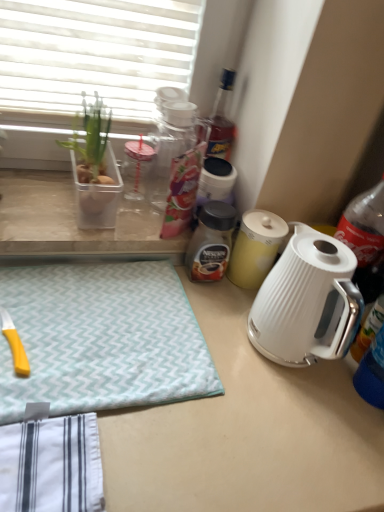
Question: Would you consider clear plastic container at left to be distant from yellow matte canister at center?

Choices:
 (A) yes
 (B) no

Answer: (B)

Question: From a real-world perspective, is clear plastic container at left positioned over yellow matte canister at center based on gravity?

Choices:
 (A) yes
 (B) no

Answer: (B)

Question: Is clear plastic container at left outside of yellow matte canister at center?

Choices:
 (A) no
 (B) yes

Answer: (B)

Question: Is clear plastic container at left bigger than yellow matte canister at center?

Choices:
 (A) yes
 (B) no

Answer: (A)

Question: Is clear plastic container at left smaller than yellow matte canister at center?

Choices:
 (A) no
 (B) yes

Answer: (A)

Question: Considering the positions of white glossy electric kettle at center-right and clear plastic container at left in the image, is white glossy electric kettle at center-right taller or shorter than clear plastic container at left?

Choices:
 (A) tall
 (B) short

Answer: (A)

Question: Is white glossy electric kettle at center-right in front of or behind clear plastic container at left in the image?

Choices:
 (A) behind
 (B) front

Answer: (B)

Question: From a real-world perspective, relative to clear plastic container at left, is white glossy electric kettle at center-right vertically above or below?

Choices:
 (A) above
 (B) below

Answer: (A)

Question: From the image's perspective, is white glossy electric kettle at center-right located above or below clear plastic container at left?

Choices:
 (A) above
 (B) below

Answer: (B)

Question: Looking at their shapes, would you say clear plastic container at left is wider or thinner than white glossy electric kettle at center?

Choices:
 (A) wide
 (B) thin

Answer: (B)

Question: From a real-world perspective, is clear plastic container at left positioned above or below white glossy electric kettle at center?

Choices:
 (A) above
 (B) below

Answer: (A)

Question: Considering the positions of point pyautogui.click(x=125, y=243) and point pyautogui.click(x=266, y=496), is point pyautogui.click(x=125, y=243) closer or farther from the camera than point pyautogui.click(x=266, y=496)?

Choices:
 (A) farther
 (B) closer

Answer: (A)

Question: From the image's perspective, is clear plastic container at left positioned above or below white glossy electric kettle at center?

Choices:
 (A) above
 (B) below

Answer: (A)

Question: In terms of height, does white glossy electric kettle at center look taller or shorter compared to brown glass jar at center?

Choices:
 (A) tall
 (B) short

Answer: (A)

Question: Is white glossy electric kettle at center inside the boundaries of brown glass jar at center, or outside?

Choices:
 (A) outside
 (B) inside

Answer: (A)